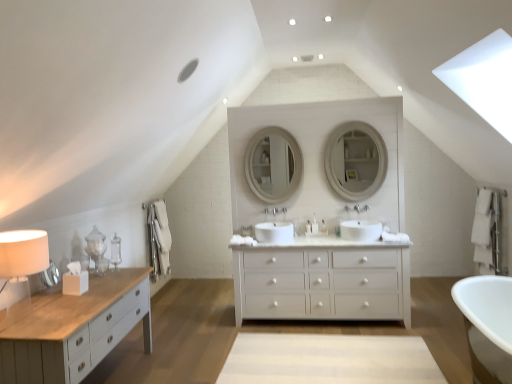
Identify the location of free space in front of white matte chest of drawers at center. The height and width of the screenshot is (384, 512). (352, 351).